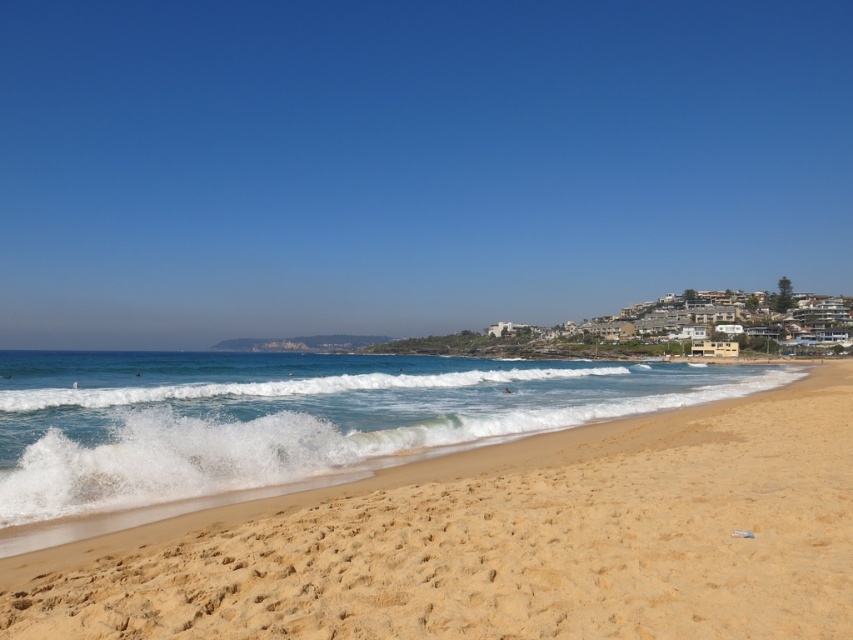
You are a beachcomber searching for treasures. You have a small bucket that can hold items up to the size of the sandy yellow at beach right. Can you safely place the white foamy wave at center into your bucket without it overflowing?

The sandy yellow at beach right is smaller than the white foamy wave at center. Since the bucket can only hold items up to the size of the sandy yellow at beach right, placing the white foamy wave at center would cause it to overflow.